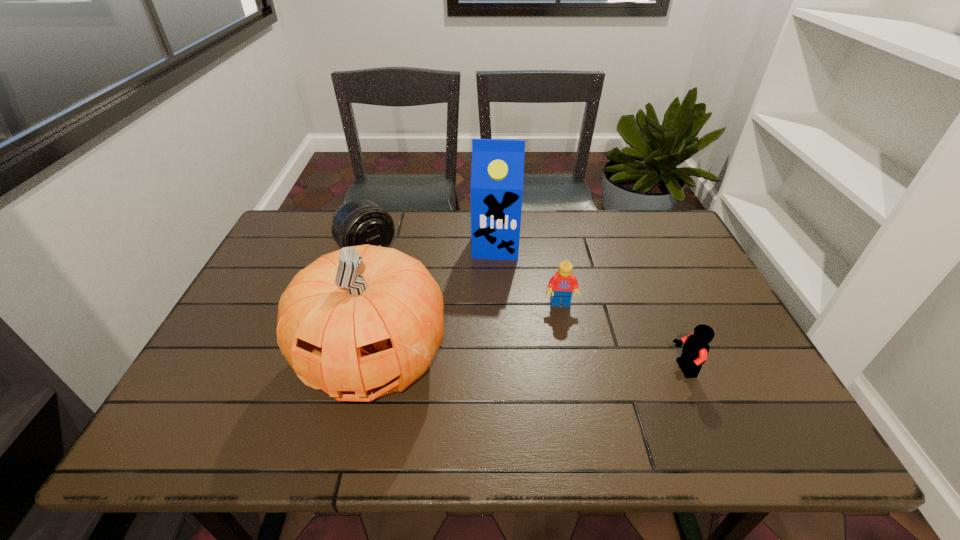
Image resolution: width=960 pixels, height=540 pixels. In order to click on free space between the carton and the nearer Lego in this screenshot , I will do `click(590, 307)`.

The image size is (960, 540). I want to click on free space that is in between the farther Lego and the pumpkin, so click(468, 332).

Identify the location of vacant space in between the third object from right to left and the nearer Lego. This screenshot has height=540, width=960. (590, 307).

The height and width of the screenshot is (540, 960). I want to click on free point between the telephoto lens and the left Lego, so click(464, 278).

Image resolution: width=960 pixels, height=540 pixels. I want to click on free spot between the left Lego and the third tallest object, so click(464, 278).

Locate an element on the screen. The width and height of the screenshot is (960, 540). free point between the rightmost object and the telephoto lens is located at coordinates point(526,310).

Identify the location of vacant point located between the carton and the telephoto lens. (431, 248).

Locate an element on the screen. The image size is (960, 540). vacant space in between the nearer Lego and the pumpkin is located at coordinates (529, 364).

Locate an element on the screen. The width and height of the screenshot is (960, 540). unoccupied area between the right Lego and the telephoto lens is located at coordinates (526, 310).

Where is `free space that is in between the right Lego and the pumpkin`? The width and height of the screenshot is (960, 540). free space that is in between the right Lego and the pumpkin is located at coordinates (529, 364).